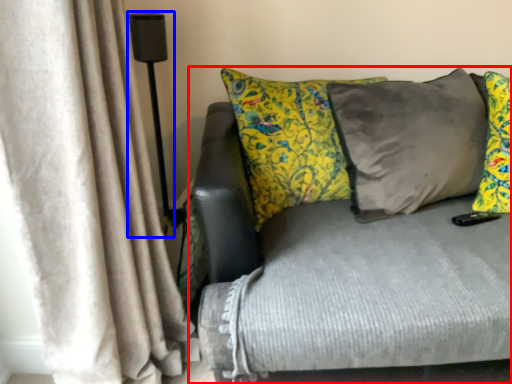
Question: Which object appears farthest to the camera in this image, studio couch (highlighted by a red box) or lamp (highlighted by a blue box)?

Choices:
 (A) studio couch
 (B) lamp

Answer: (B)